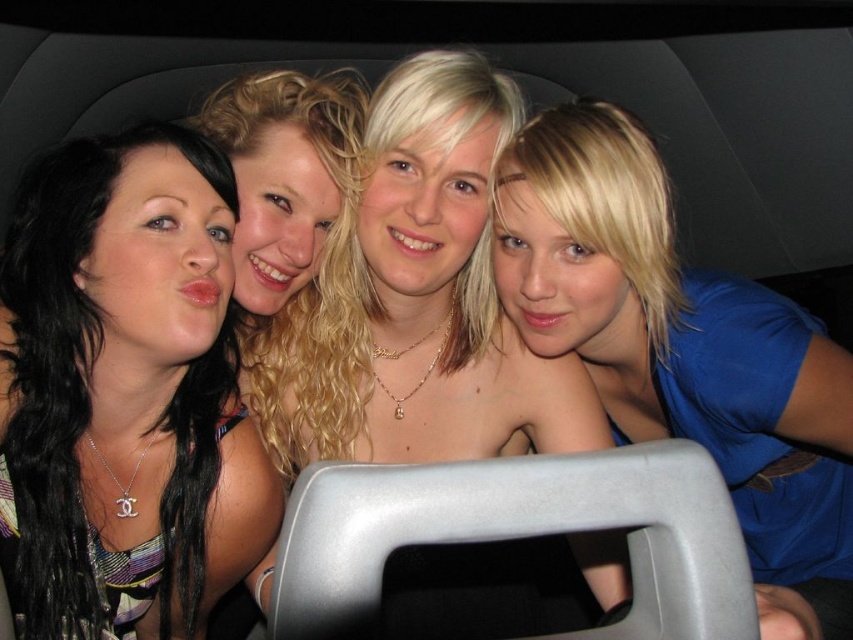
Who is positioned more to the right, matte black hair at left or blue matte shirt at upper right?

blue matte shirt at upper right

Which is behind, point (88, 282) or point (619, 362)?

The point (619, 362) is more distant.

Where is `matte black hair at left`? matte black hair at left is located at coordinates (125, 394).